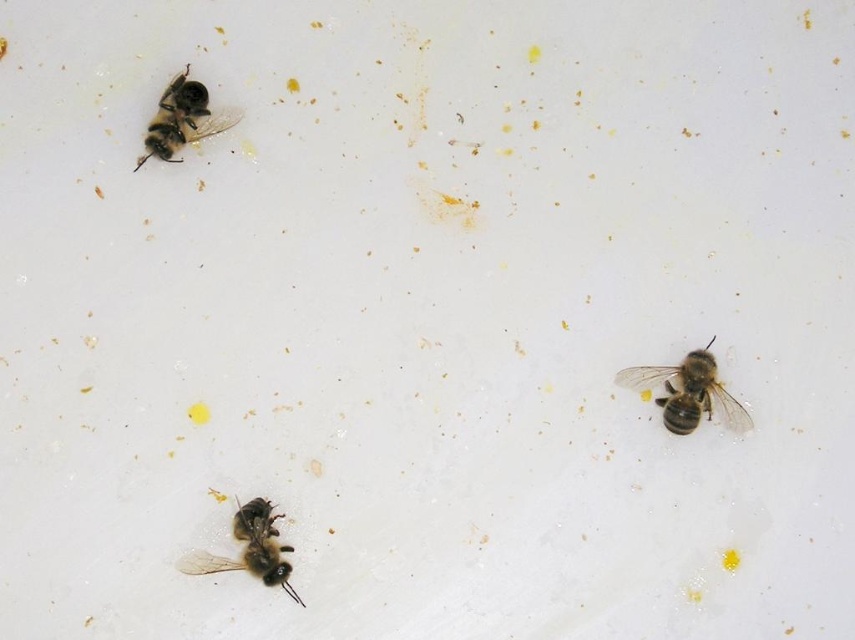
You are a beekeeper examining the white surface with two brown fuzzy bees. Which bee is closer to you, the brown fuzzy bee at right or the brown fuzzy bee at upper left?

The brown fuzzy bee at right is closer to you because it is further to the viewer than the brown fuzzy bee at upper left.

You are a photographer trying to capture a closeup of the bee at point (169, 125) and the bee at point (278, 556). Based on their positions, which bee will appear larger in your photo?

The bee at point (169, 125) will appear larger in the photo because it is closer to the camera than the bee at point (278, 556).

You are a beekeeper observing the three bees on the white surface. You notice that one of the bees is at point (251, 548). Based on the coordinates, can you determine the position of the black fuzzy bee relative to the other bees?

The black fuzzy bee is located at lower left, so it is positioned to the left and below the other bees.